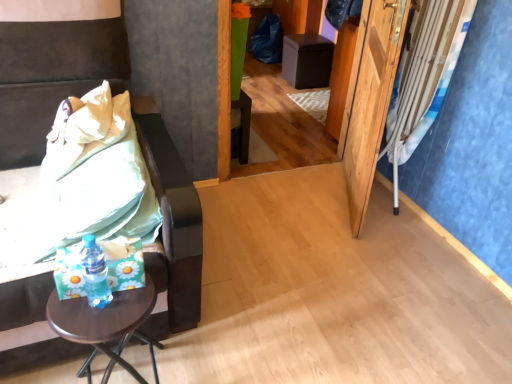
The height and width of the screenshot is (384, 512). I want to click on vacant area that is in front of blue fabric curtain at right, so click(400, 221).